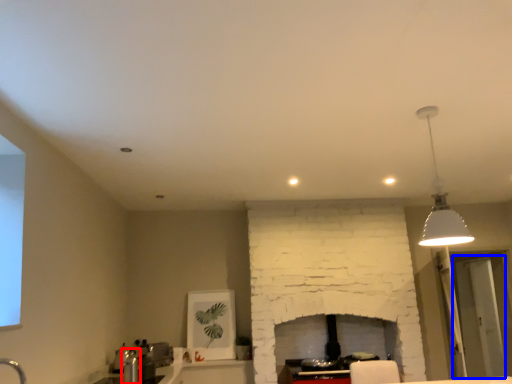
Question: Which object is further to the camera taking this photo, faucet (highlighted by a red box) or glass door (highlighted by a blue box)?

Choices:
 (A) faucet
 (B) glass door

Answer: (B)